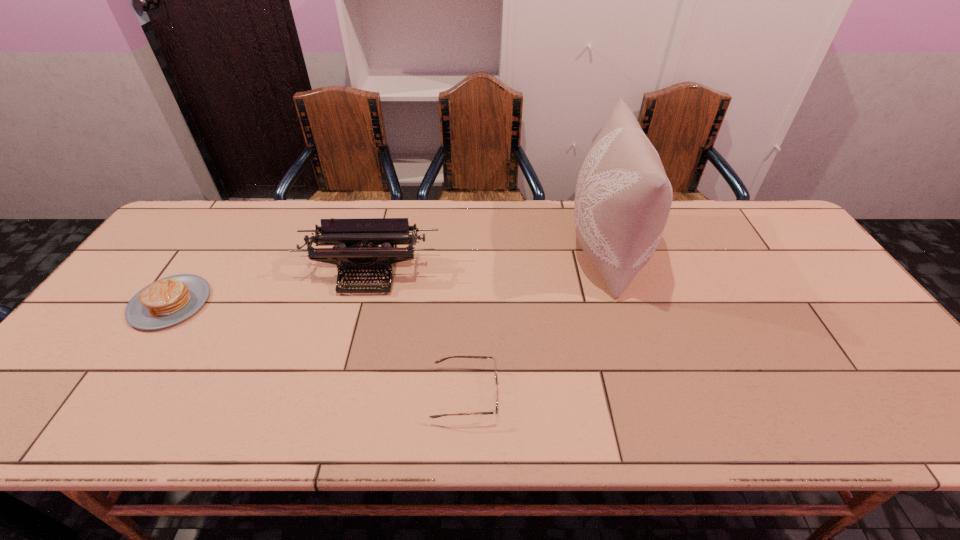
Select which object is the third closest to the leftmost object. Please provide its 2D coordinates. Your answer should be formatted as a tuple, i.e. [(x, y)], where the tuple contains the x and y coordinates of a point satisfying the conditions above.

[(623, 197)]

Image resolution: width=960 pixels, height=540 pixels. I want to click on the second closest object to the pancake, so click(496, 395).

The width and height of the screenshot is (960, 540). I want to click on free spot that satisfies the following two spatial constraints: 1. on the front side of the tallest object; 2. on the typing side of the second object from left to right, so click(x=613, y=274).